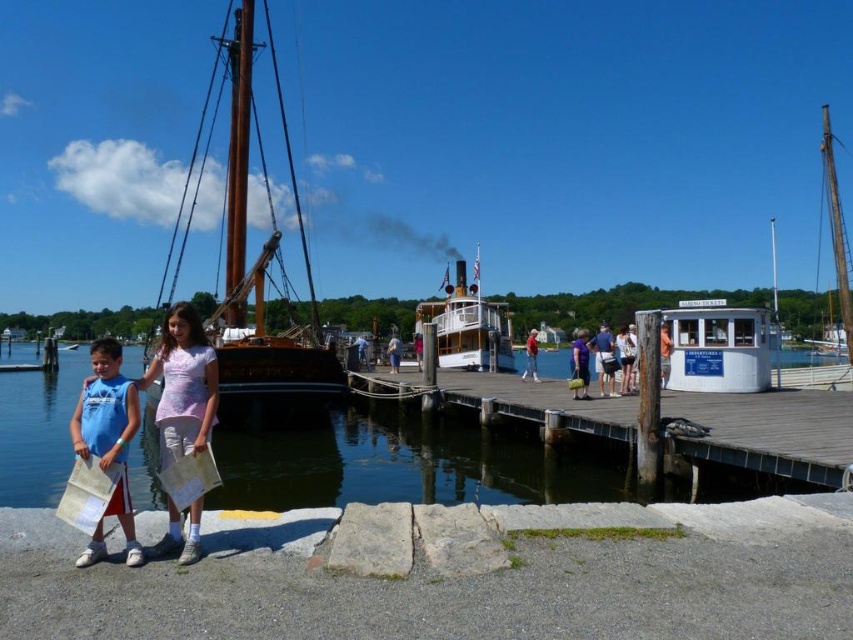
You are standing at the marina and want to determine the relative positions of two points marked in the image. Which of the two points, point 1 at coordinates [178,369] or point 2 at [509,346], is closer to you?

Point 1 at coordinates [178,369] is closer to the viewer than point 2 at [509,346].

You are a photographer trying to capture the wooden sailboat at left and the clear water at lower left in your shot. Based on their widths, which one should you focus on if you want to include as much of the object as possible in your frame?

The clear water at lower left might be wider than wooden sailboat at left, so focusing on the clear water at lower left would allow you to include more of it in your frame.